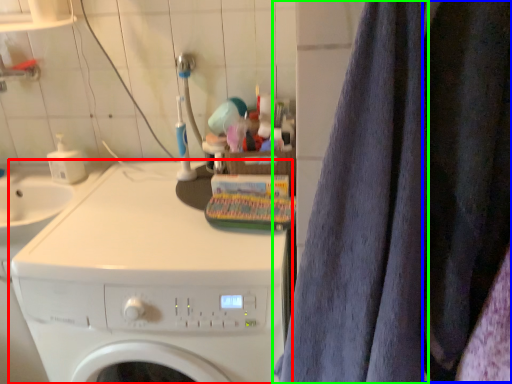
Question: Estimate the real-world distances between objects in this image. Which object is farther from washing machine (highlighted by a red box), clothing (highlighted by a blue box) or bath towel (highlighted by a green box)?

Choices:
 (A) clothing
 (B) bath towel

Answer: (A)